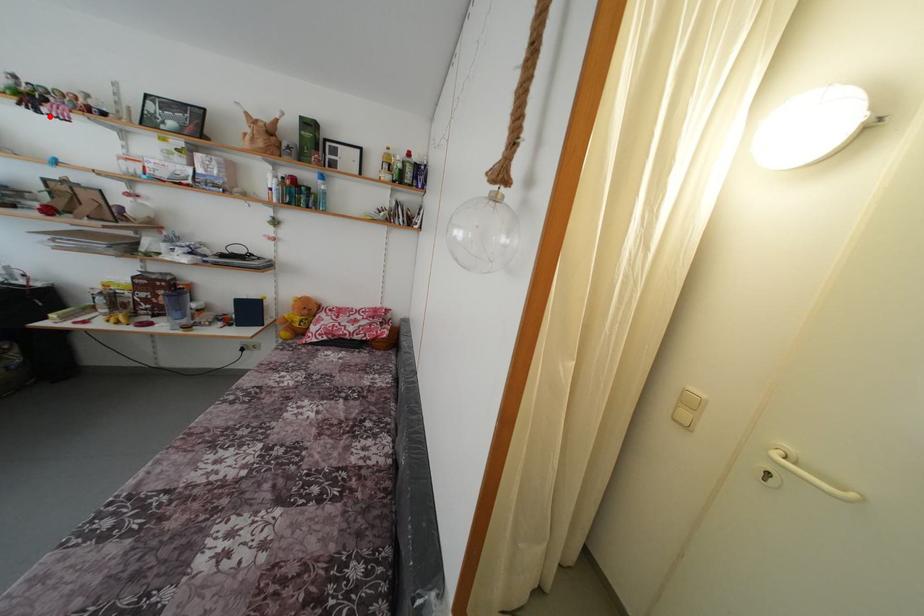
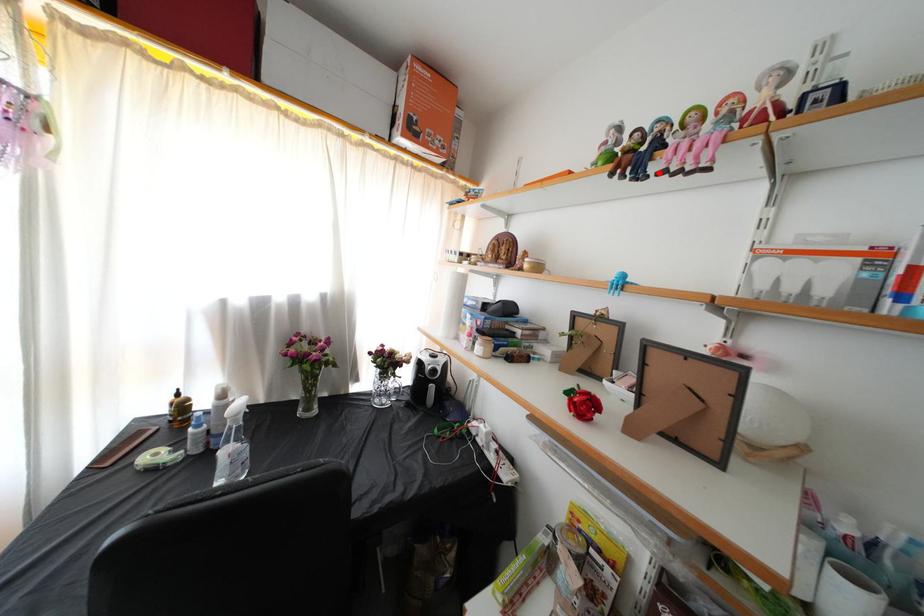
I am providing you with two images of the same scene from different viewpoints. A red point is marked on the first image and another point is marked on the second image. Are the points marked in image1 and image2 representing the same 3D position?

Yes